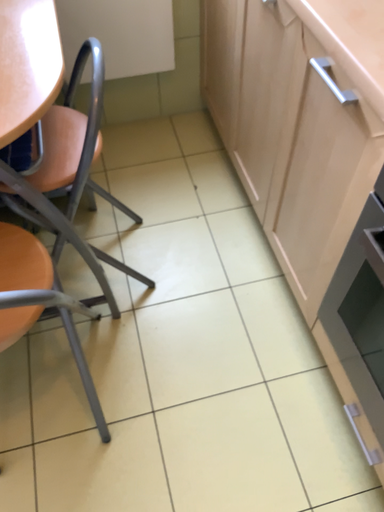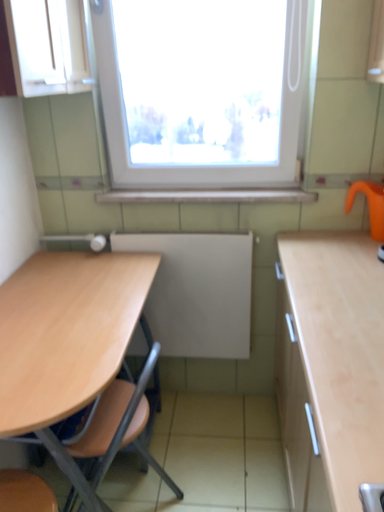
Question: How did the camera likely rotate when shooting the video?

Choices:
 (A) rotated downward
 (B) rotated upward

Answer: (B)